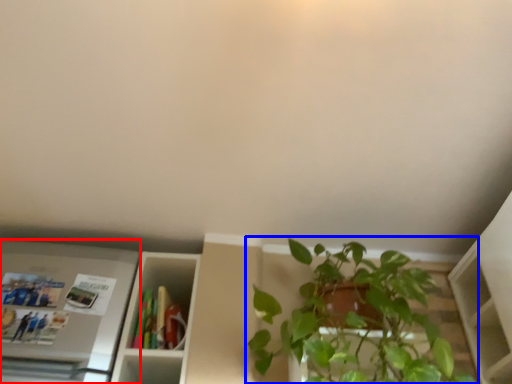
Question: Among these objects, which one is farthest to the camera, appliance (highlighted by a red box) or houseplant (highlighted by a blue box)?

Choices:
 (A) appliance
 (B) houseplant

Answer: (A)